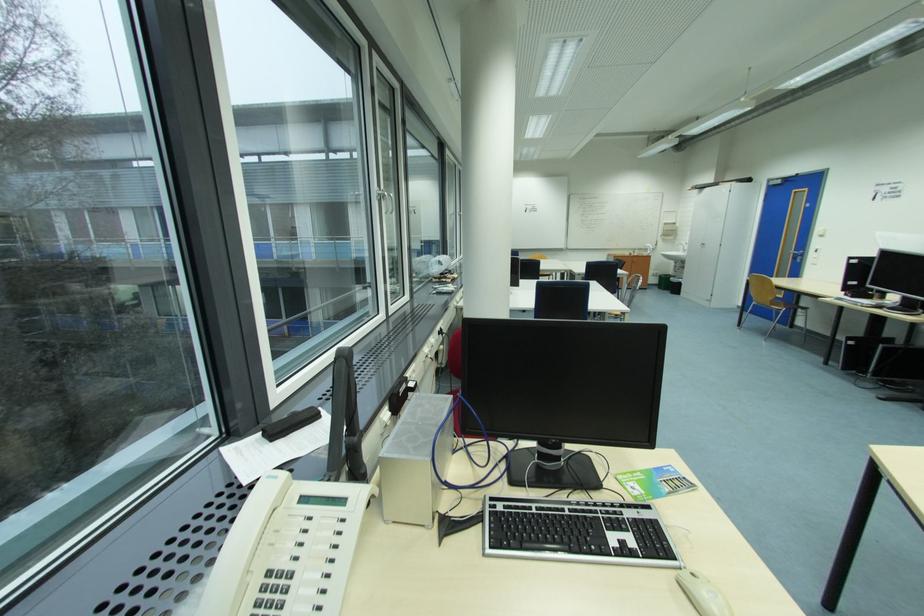
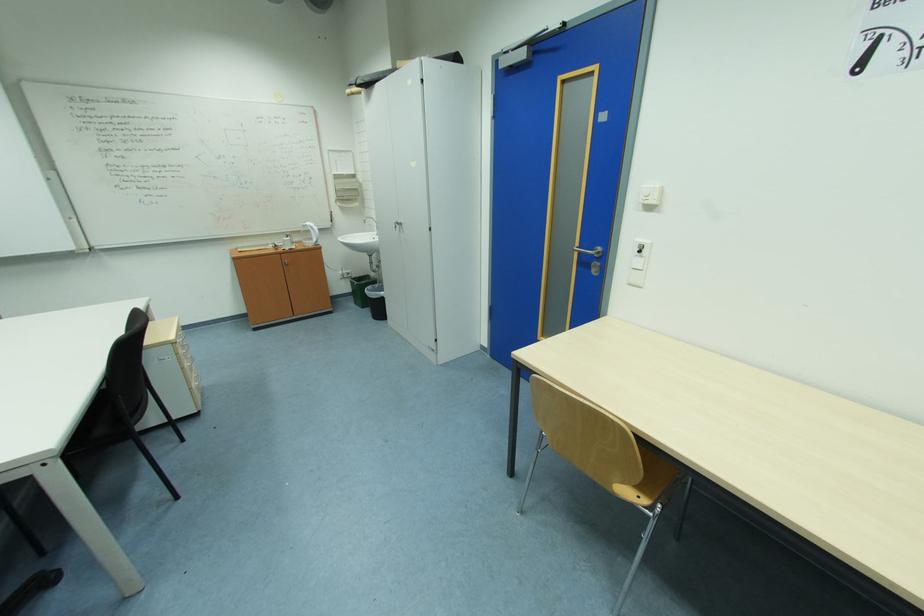
Find the pixel in the second image that matches the point at 803,259 in the first image.

(590, 264)